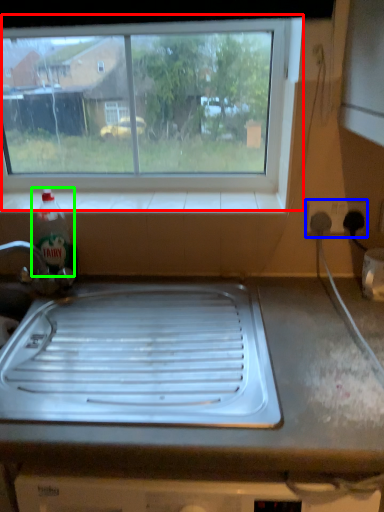
Question: Which object is the farthest from window (highlighted by a red box)? Choose among these: electric outlet (highlighted by a blue box) or bottle (highlighted by a green box).

Choices:
 (A) electric outlet
 (B) bottle

Answer: (B)